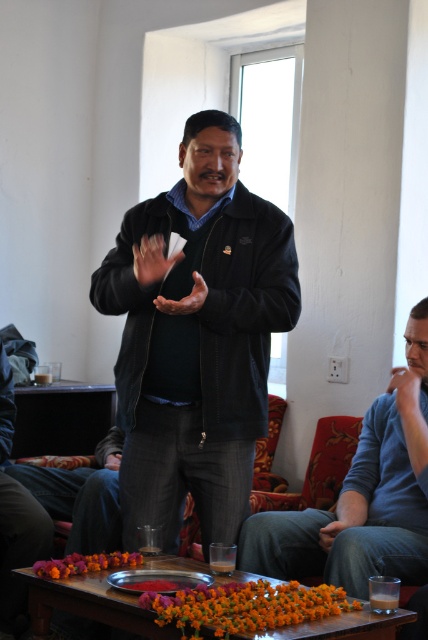
Describe the element at coordinates (198, 339) in the screenshot. I see `black matte jacket at center` at that location.

This screenshot has height=640, width=428. I want to click on black matte jacket at center, so click(198, 339).

Can you confirm if matte black hand at center is smaller than brown leather hand at center?

Incorrect, matte black hand at center is not smaller in size than brown leather hand at center.

Is matte black hand at center to the right of brown leather hand at center from the viewer's perspective?

In fact, matte black hand at center is to the left of brown leather hand at center.

Who is more forward, (x=166, y=257) or (x=201, y=289)?

Positioned in front is point (x=201, y=289).

Where is `matte black hand at center`? This screenshot has height=640, width=428. matte black hand at center is located at coordinates (152, 259).

Does black matte jacket at center have a greater width compared to matte black hand at center?

Yes.

Does black matte jacket at center have a lesser width compared to matte black hand at center?

No.

Measure the distance between point [226,356] and camera.

The distance of point [226,356] from camera is 2.82 meters.

Where is `black matte jacket at center`? This screenshot has width=428, height=640. black matte jacket at center is located at coordinates (198, 339).